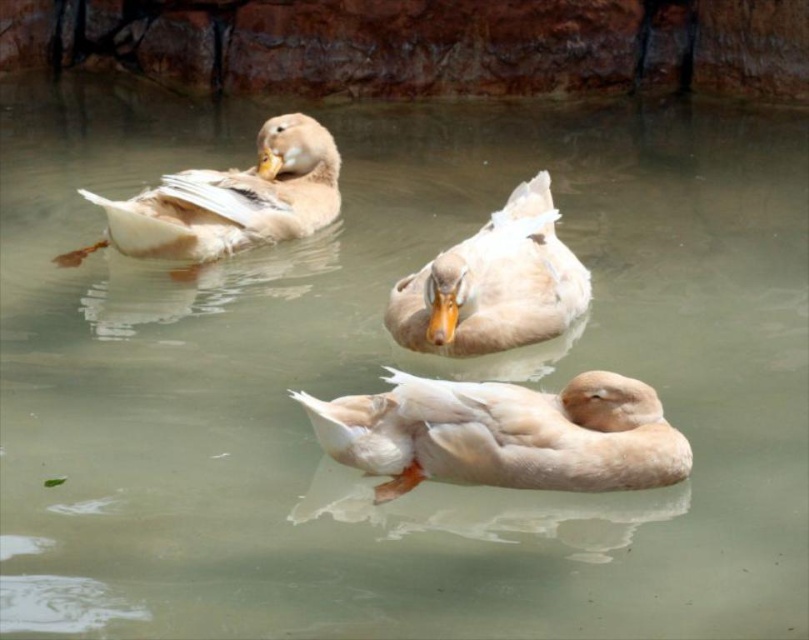
Question: Which object is closer to the camera taking this photo?

Choices:
 (A) white matte duck at center
 (B) light brown feathered duck at center

Answer: (B)

Question: Considering the real-world distances, which object is closest to the light brown feathered duck at center?

Choices:
 (A) white matte duck at center
 (B) light brown feathered duck at upper left

Answer: (A)

Question: Considering the real-world distances, which object is farthest from the light brown feathered duck at upper left?

Choices:
 (A) light brown feathered duck at center
 (B) white matte duck at center

Answer: (A)

Question: Does light brown feathered duck at center have a larger size compared to light brown feathered duck at upper left?

Choices:
 (A) yes
 (B) no

Answer: (B)

Question: Can you confirm if white matte duck at center is positioned above light brown feathered duck at upper left?

Choices:
 (A) no
 (B) yes

Answer: (A)

Question: Can you confirm if light brown feathered duck at center is positioned to the left of white matte duck at center?

Choices:
 (A) yes
 (B) no

Answer: (B)